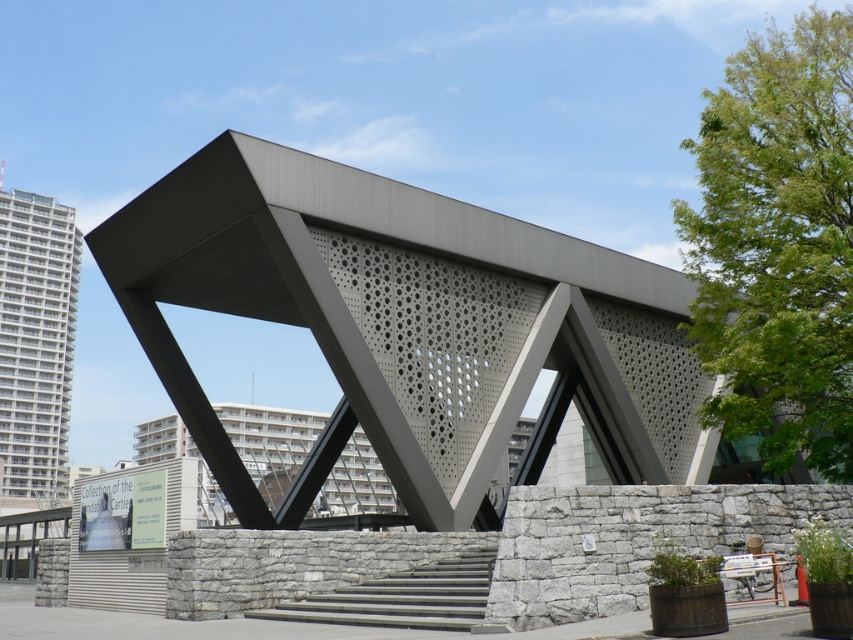
Question: Can you confirm if white concrete building at left is positioned to the right of gray concrete stairs at center?

Choices:
 (A) yes
 (B) no

Answer: (B)

Question: Can you confirm if white concrete building at left is bigger than gray concrete stairs at center?

Choices:
 (A) yes
 (B) no

Answer: (A)

Question: Which point is closer to the camera?

Choices:
 (A) (437, 572)
 (B) (28, 348)

Answer: (A)

Question: Which of the following is the closest to the observer?

Choices:
 (A) (26, 476)
 (B) (397, 602)

Answer: (B)

Question: Is white concrete building at left thinner than gray concrete stairs at center?

Choices:
 (A) no
 (B) yes

Answer: (A)

Question: Which object appears closest to the camera in this image?

Choices:
 (A) white concrete building at left
 (B) gray concrete stairs at center

Answer: (B)